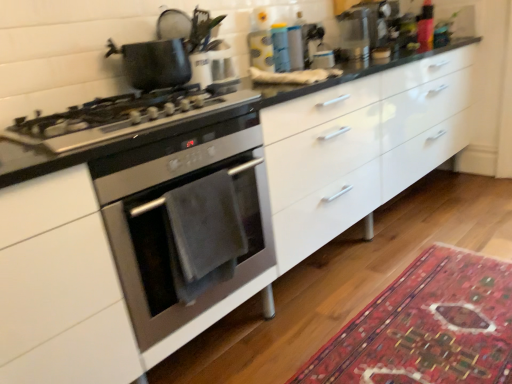
Question: Is stainless steel oven at left turned away from matte black pot at upper left?

Choices:
 (A) no
 (B) yes

Answer: (A)

Question: Can you confirm if stainless steel oven at left is shorter than matte black pot at upper left?

Choices:
 (A) no
 (B) yes

Answer: (A)

Question: Could you tell me if stainless steel oven at left is turned towards matte black pot at upper left?

Choices:
 (A) no
 (B) yes

Answer: (A)

Question: Can you confirm if stainless steel oven at left is positioned to the right of matte black pot at upper left?

Choices:
 (A) yes
 (B) no

Answer: (A)

Question: Is stainless steel oven at left in contact with matte black pot at upper left?

Choices:
 (A) no
 (B) yes

Answer: (A)

Question: From a real-world perspective, is satin silver gas stove at left above or below stainless steel oven at left?

Choices:
 (A) above
 (B) below

Answer: (A)

Question: Is point (16, 119) closer or farther from the camera than point (234, 157)?

Choices:
 (A) farther
 (B) closer

Answer: (A)

Question: From the image's perspective, relative to stainless steel oven at left, is satin silver gas stove at left above or below?

Choices:
 (A) below
 (B) above

Answer: (B)

Question: Is satin silver gas stove at left in front of or behind stainless steel oven at left in the image?

Choices:
 (A) front
 (B) behind

Answer: (A)

Question: From the image's perspective, relative to stainless steel oven at left, is carpet with intricate patterns at lower right above or below?

Choices:
 (A) above
 (B) below

Answer: (B)

Question: In terms of width, does carpet with intricate patterns at lower right look wider or thinner when compared to stainless steel oven at left?

Choices:
 (A) wide
 (B) thin

Answer: (A)

Question: Based on their sizes in the image, would you say carpet with intricate patterns at lower right is bigger or smaller than stainless steel oven at left?

Choices:
 (A) small
 (B) big

Answer: (A)

Question: Is carpet with intricate patterns at lower right inside the boundaries of stainless steel oven at left, or outside?

Choices:
 (A) inside
 (B) outside

Answer: (B)

Question: Considering the positions of satin silver gas stove at left and carpet with intricate patterns at lower right in the image, is satin silver gas stove at left taller or shorter than carpet with intricate patterns at lower right?

Choices:
 (A) short
 (B) tall

Answer: (B)

Question: Does point (49, 142) appear closer or farther from the camera than point (424, 296)?

Choices:
 (A) closer
 (B) farther

Answer: (A)